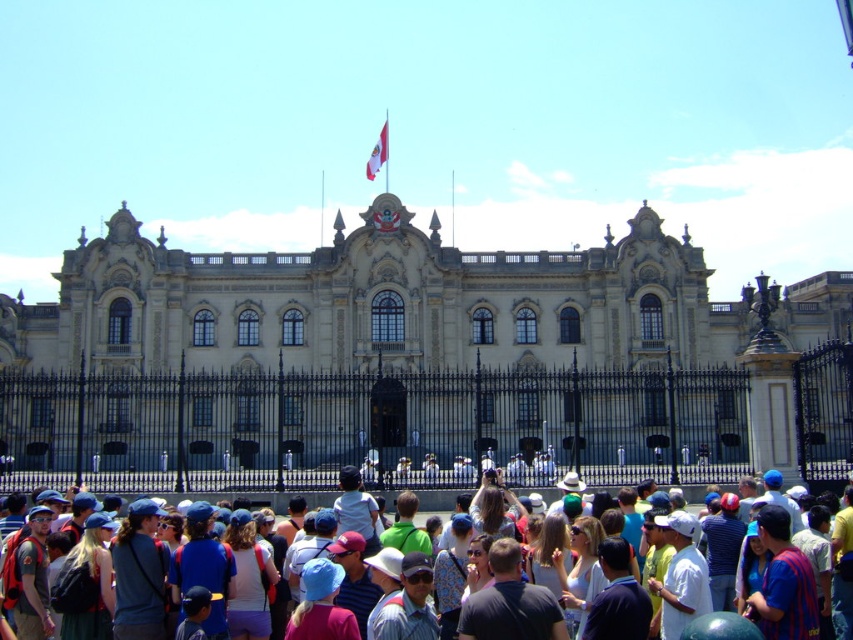
Question: From the image, what is the correct spatial relationship of beige stone palace at center in relation to denim shorts at lower center?

Choices:
 (A) left
 (B) right

Answer: (B)

Question: Which point appears closest to the camera in this image?

Choices:
 (A) (7, 484)
 (B) (451, 284)

Answer: (A)

Question: Does matte black backpack at lower left appear under multicolored casual attire at center?

Choices:
 (A) yes
 (B) no

Answer: (A)

Question: Does denim shorts at lower center have a lesser width compared to multicolored casual attire at center?

Choices:
 (A) yes
 (B) no

Answer: (A)

Question: Based on their relative distances, which object is nearer to the white cotton shirt at center?

Choices:
 (A) denim shorts at lower center
 (B) multicolored casual attire at center
 (C) beige stone palace at center

Answer: (B)

Question: Which point appears farthest from the camera in this image?

Choices:
 (A) (419, 497)
 (B) (263, 552)
 (C) (527, 426)
 (D) (554, 554)

Answer: (C)